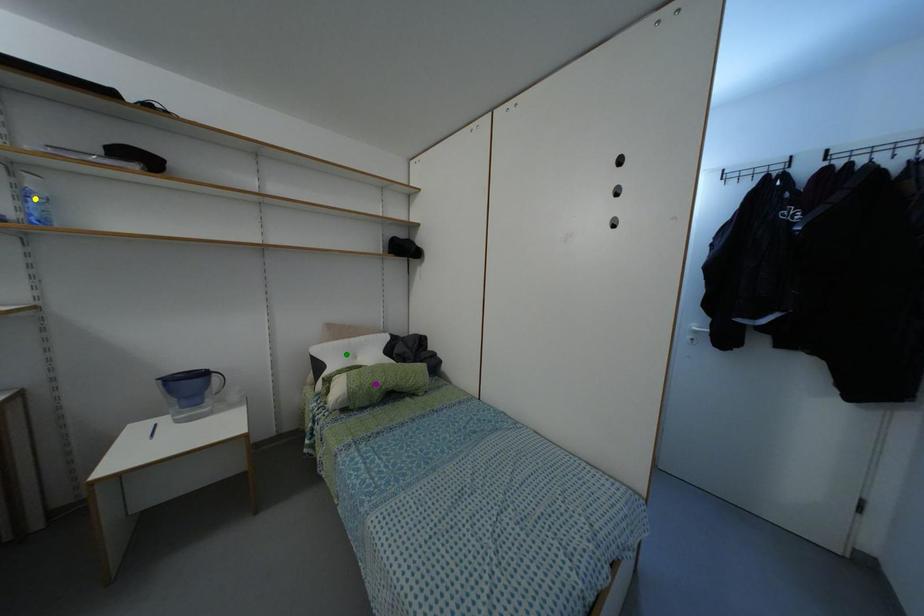
Order these from nearest to farthest:
1. purple point
2. yellow point
3. green point

green point, purple point, yellow point